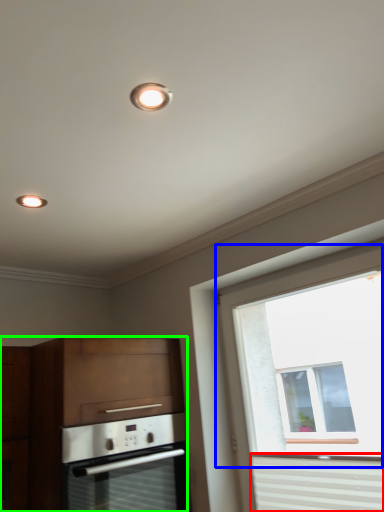
Question: Which is farther away from curtain (highlighted by a red box)? window (highlighted by a blue box) or cabinetry (highlighted by a green box)?

Choices:
 (A) window
 (B) cabinetry

Answer: (A)